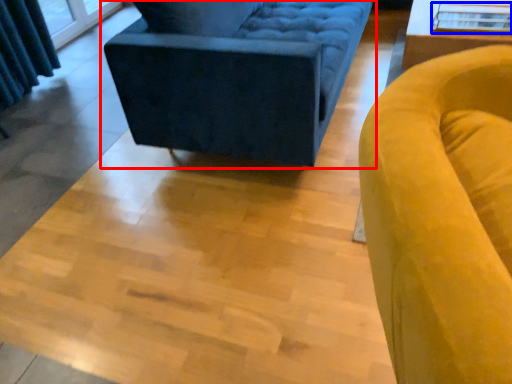
Question: Which object appears farthest to the camera in this image, studio couch (highlighted by a red box) or glass table (highlighted by a blue box)?

Choices:
 (A) studio couch
 (B) glass table

Answer: (B)